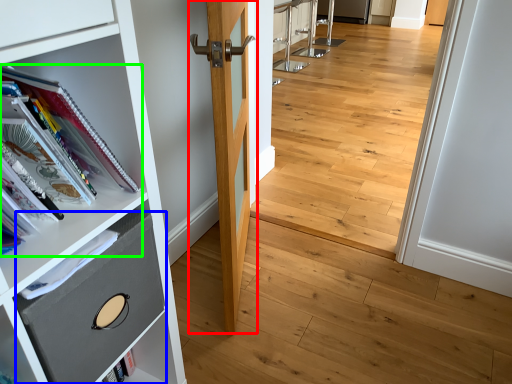
Question: Which is farther away from door (highlighted by a red box)? drawer (highlighted by a blue box) or book (highlighted by a green box)?

Choices:
 (A) drawer
 (B) book

Answer: (A)